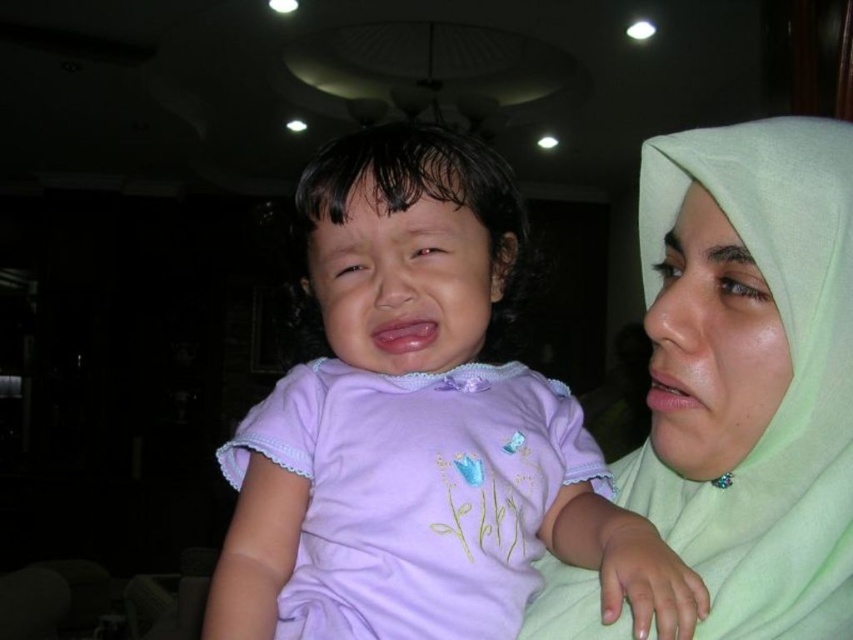
Can you confirm if purple soft fabric shirt at center is wider than light green fabric at upper right?

Yes.

Does purple soft fabric shirt at center have a lesser width compared to light green fabric at upper right?

No, purple soft fabric shirt at center is not thinner than light green fabric at upper right.

Who is more distant from viewer, (589, 449) or (793, 189)?

The point (589, 449) is more distant.

What are the coordinates of `purple soft fabric shirt at center` in the screenshot? It's located at (421, 428).